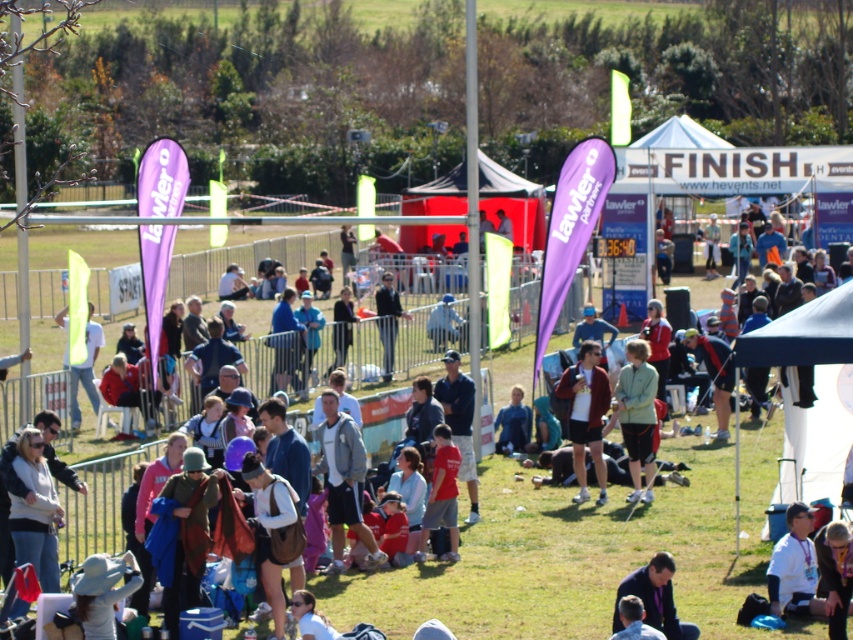
You are a photographer at the event and want to capture both the matte black jacket at center and the light green fabric jacket at center in a single shot. Which jacket should you position closer to the left side of your camera frame to ensure both are visible?

To capture both the matte black jacket at center and the light green fabric jacket at center in a single shot, position the matte black jacket at center closer to the left side of your camera frame since it is already to the left of the light green fabric jacket at center in the scene.

You are a photographer at the event and need to capture a photo of both the gray fabric jacket at center and the dark blue shirt at lower center. Which object should you focus on first to ensure both are in frame without moving the camera?

You should focus on the gray fabric jacket at center first because it is taller than the dark blue shirt at lower center, so starting with the taller object will help frame both in the photo.

You are a participant in the race and want to know which of the two points, point (585, 340) or point (643, 611), is closer to you as you cross the finish line. Which one should you aim for if you want to reach the closer one first?

Point (585, 340) is closer to you than point (643, 611), so you should aim for point (585, 340) first.